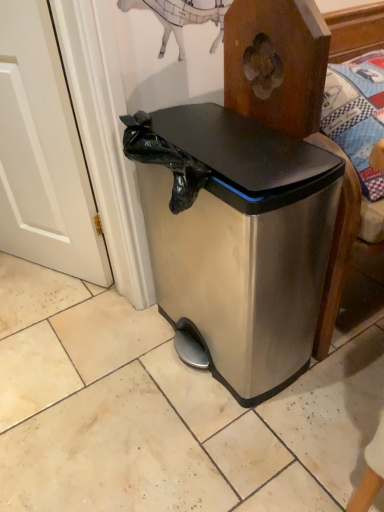
You are a GUI agent. You are given a task and a screenshot of the screen. Output one action in this format:
    pyautogui.click(x=<x>, y=<y>)
    Task: Click on the unoccupied area in front of stainless steel trash can at center
    This screenshot has height=512, width=384.
    Given the screenshot: What is the action you would take?
    pyautogui.click(x=221, y=449)